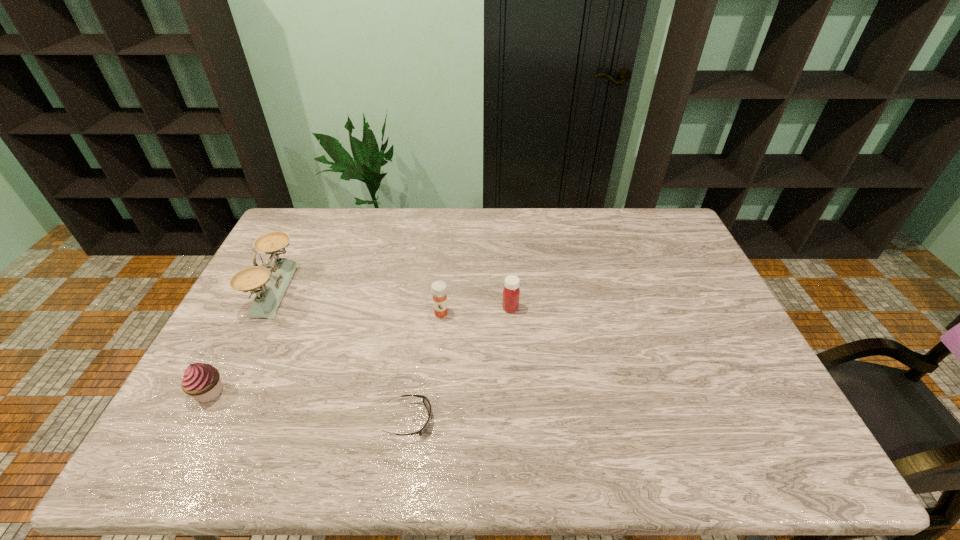
Find the location of `free point between the cupcake and the rightmost object`. free point between the cupcake and the rightmost object is located at coordinates (360, 350).

Find the location of a particular element. The width and height of the screenshot is (960, 540). free point between the cupcake and the shortest object is located at coordinates (309, 406).

You are a GUI agent. You are given a task and a screenshot of the screen. Output one action in this format:
    pyautogui.click(x=<x>, y=<y>)
    Task: Click on the vacant area between the rightmost object and the tallest object
    This screenshot has height=540, width=960.
    Given the screenshot: What is the action you would take?
    pyautogui.click(x=393, y=299)

Locate an element on the screen. Image resolution: width=960 pixels, height=540 pixels. vacant area that lies between the goggles and the cupcake is located at coordinates (309, 406).

Find the location of a particular element. free space between the right medicine and the goggles is located at coordinates (460, 364).

Find the location of a particular element. The width and height of the screenshot is (960, 540). free spot between the cupcake and the right medicine is located at coordinates (360, 350).

Locate an element on the screen. vacant region between the cupcake and the rightmost object is located at coordinates click(x=360, y=350).

The image size is (960, 540). I want to click on object that is the fourth nearest to the goggles, so click(x=272, y=284).

Locate which object ranks fourth in proximity to the tallest object. Please provide its 2D coordinates. Your answer should be formatted as a tuple, i.e. [(x, y)], where the tuple contains the x and y coordinates of a point satisfying the conditions above.

[(511, 293)]

Find the location of a particular element. This screenshot has width=960, height=540. free location that satisfies the following two spatial constraints: 1. on the back side of the cupcake; 2. on the right side of the rightmost object is located at coordinates (253, 308).